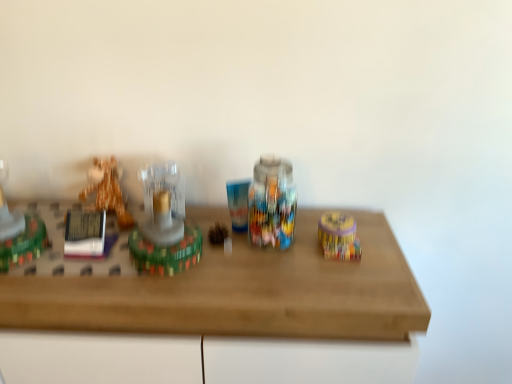
What is the approximate height of matte yellow container at right, which ranks as the 4th toy in left-to-right order?

matte yellow container at right, which ranks as the 4th toy in left-to-right order, is 0.93 inches in height.

Describe the element at coordinates (339, 236) in the screenshot. I see `matte yellow container at right, which is counted as the first toy, starting from the right` at that location.

This screenshot has height=384, width=512. I want to click on translucent glass candle at center, placed as the third toy when sorted from left to right, so click(x=164, y=226).

You are a GUI agent. You are given a task and a screenshot of the screen. Output one action in this format:
    pyautogui.click(x=<x>, y=<y>)
    Task: Click on the plush orange bear at left, which is counted as the second toy, starting from the left
    The image size is (512, 384).
    Given the screenshot: What is the action you would take?
    pyautogui.click(x=106, y=190)

Considering the positions of point (36, 243) and point (242, 296), is point (36, 243) closer or farther from the camera than point (242, 296)?

Clearly, point (36, 243) is more distant from the camera than point (242, 296).

Does shiny green plastic toy at left, which appears as the 4th toy when viewed from the right, lie in front of wooden table at center?

No, the depth of shiny green plastic toy at left, which appears as the 4th toy when viewed from the right, is greater than that of wooden table at center.

Can wooden table at center be found inside shiny green plastic toy at left, acting as the 1th toy starting from the left?

No, wooden table at center is not a part of shiny green plastic toy at left, acting as the 1th toy starting from the left.

Looking at this image, does shiny green plastic toy at left, which appears as the 4th toy when viewed from the right, have a lesser height compared to wooden table at center?

Yes.

From the image's perspective, is wooden table at center on shiny green plastic toy at left, which appears as the 4th toy when viewed from the right?

No, from the image's perspective, wooden table at center is not on top of shiny green plastic toy at left, which appears as the 4th toy when viewed from the right.

Can shiny green plastic toy at left, acting as the 1th toy starting from the left, be found inside wooden table at center?

That's incorrect, shiny green plastic toy at left, acting as the 1th toy starting from the left, is not inside wooden table at center.

Is wooden table at center at the left side of shiny green plastic toy at left, which appears as the 4th toy when viewed from the right?

In fact, wooden table at center is to the right of shiny green plastic toy at left, which appears as the 4th toy when viewed from the right.

Which of these two, wooden table at center or shiny green plastic toy at left, acting as the 1th toy starting from the left, is thinner?

Thinner between the two is shiny green plastic toy at left, acting as the 1th toy starting from the left.

Based on the photo, considering the sizes of objects matte yellow container at right, which ranks as the 4th toy in left-to-right order, and shiny green plastic toy at left, which appears as the 4th toy when viewed from the right, in the image provided, who is thinner, matte yellow container at right, which ranks as the 4th toy in left-to-right order, or shiny green plastic toy at left, which appears as the 4th toy when viewed from the right,?

matte yellow container at right, which ranks as the 4th toy in left-to-right order, is thinner.

Is matte yellow container at right, which is counted as the first toy, starting from the right, positioned far away from shiny green plastic toy at left, acting as the 1th toy starting from the left?

No, matte yellow container at right, which is counted as the first toy, starting from the right, is in close proximity to shiny green plastic toy at left, acting as the 1th toy starting from the left.

Is shiny green plastic toy at left, acting as the 1th toy starting from the left, inside matte yellow container at right, which is counted as the first toy, starting from the right?

Definitely not — shiny green plastic toy at left, acting as the 1th toy starting from the left, is not inside matte yellow container at right, which is counted as the first toy, starting from the right.

From the image's perspective, is translucent glass candle at center, placed as the third toy when sorted from left to right, located beneath matte yellow container at right, which ranks as the 4th toy in left-to-right order?

No, from the image's perspective, translucent glass candle at center, placed as the third toy when sorted from left to right, is not below matte yellow container at right, which ranks as the 4th toy in left-to-right order.

Can you confirm if translucent glass candle at center, placed as the third toy when sorted from left to right, is taller than matte yellow container at right, which is counted as the first toy, starting from the right?

Indeed, translucent glass candle at center, placed as the third toy when sorted from left to right, has a greater height compared to matte yellow container at right, which is counted as the first toy, starting from the right.

Can you tell me how much translucent glass candle at center, positioned as the second toy in right-to-left order, and matte yellow container at right, which is counted as the first toy, starting from the right, differ in facing direction?

The angle between the facing direction of translucent glass candle at center, positioned as the second toy in right-to-left order, and the facing direction of matte yellow container at right, which is counted as the first toy, starting from the right, is 1.97 degrees.

Does translucent glass candle at center, positioned as the second toy in right-to-left order, have a smaller size compared to matte yellow container at right, which is counted as the first toy, starting from the right?

No, translucent glass candle at center, positioned as the second toy in right-to-left order, is not smaller than matte yellow container at right, which is counted as the first toy, starting from the right.

Considering the relative sizes of plush orange bear at left, the 3th toy viewed from the right, and matte yellow container at right, which is counted as the first toy, starting from the right, in the image provided, is plush orange bear at left, the 3th toy viewed from the right, shorter than matte yellow container at right, which is counted as the first toy, starting from the right,?

Incorrect, the height of plush orange bear at left, the 3th toy viewed from the right, does not fall short of that of matte yellow container at right, which is counted as the first toy, starting from the right.

Are plush orange bear at left, which is counted as the second toy, starting from the left, and matte yellow container at right, which is counted as the first toy, starting from the right, making contact?

No, plush orange bear at left, which is counted as the second toy, starting from the left, is not touching matte yellow container at right, which is counted as the first toy, starting from the right.

Is plush orange bear at left, the 3th toy viewed from the right, facing towards matte yellow container at right, which ranks as the 4th toy in left-to-right order?

No, plush orange bear at left, the 3th toy viewed from the right, does not turn towards matte yellow container at right, which ranks as the 4th toy in left-to-right order.

Is plush orange bear at left, which is counted as the second toy, starting from the left, inside or outside of matte yellow container at right, which is counted as the first toy, starting from the right?

plush orange bear at left, which is counted as the second toy, starting from the left, is spatially situated outside matte yellow container at right, which is counted as the first toy, starting from the right.

Is plush orange bear at left, the 3th toy viewed from the right, in contact with shiny green plastic toy at left, which appears as the 4th toy when viewed from the right?

plush orange bear at left, the 3th toy viewed from the right, and shiny green plastic toy at left, which appears as the 4th toy when viewed from the right, are clearly separated.

Which toy is the 2nd one when counting from the front of the plush orange bear at left, the 3th toy viewed from the right? Please provide its 2D coordinates.

[(19, 232)]

Can you tell me how much plush orange bear at left, the 3th toy viewed from the right, and shiny green plastic toy at left, which appears as the 4th toy when viewed from the right, differ in facing direction?

They differ by 0.000105 degrees in their facing directions.

Is plush orange bear at left, which is counted as the second toy, starting from the left, inside the boundaries of shiny green plastic toy at left, which appears as the 4th toy when viewed from the right, or outside?

plush orange bear at left, which is counted as the second toy, starting from the left, is not enclosed by shiny green plastic toy at left, which appears as the 4th toy when viewed from the right.

From the image's perspective, would you say shiny green plastic toy at left, which appears as the 4th toy when viewed from the right, is shown under translucent glass candle at center, placed as the third toy when sorted from left to right?

No, from the image's perspective, shiny green plastic toy at left, which appears as the 4th toy when viewed from the right, is not beneath translucent glass candle at center, placed as the third toy when sorted from left to right.

Considering the relative sizes of shiny green plastic toy at left, which appears as the 4th toy when viewed from the right, and translucent glass candle at center, positioned as the second toy in right-to-left order, in the image provided, is shiny green plastic toy at left, which appears as the 4th toy when viewed from the right, taller than translucent glass candle at center, positioned as the second toy in right-to-left order,?

Incorrect, the height of shiny green plastic toy at left, which appears as the 4th toy when viewed from the right, is not larger of that of translucent glass candle at center, positioned as the second toy in right-to-left order.

Considering the sizes of objects shiny green plastic toy at left, which appears as the 4th toy when viewed from the right, and translucent glass candle at center, placed as the third toy when sorted from left to right, in the image provided, who is wider, shiny green plastic toy at left, which appears as the 4th toy when viewed from the right, or translucent glass candle at center, placed as the third toy when sorted from left to right,?

With larger width is shiny green plastic toy at left, which appears as the 4th toy when viewed from the right.

Identify the location of toy that is the 3rd one when counting upward from the wooden table at center (from the image's perspective). (19, 232).

You are a GUI agent. You are given a task and a screenshot of the screen. Output one action in this format:
    pyautogui.click(x=<x>, y=<y>)
    Task: Click on the table on the right of shiny green plastic toy at left, which appears as the 4th toy when viewed from the right
    Image resolution: width=512 pixels, height=384 pixels.
    Given the screenshot: What is the action you would take?
    pyautogui.click(x=223, y=287)

Considering their positions, is wooden table at center positioned further to matte yellow container at right, which ranks as the 4th toy in left-to-right order, than shiny green plastic toy at left, which appears as the 4th toy when viewed from the right?

Based on the image, shiny green plastic toy at left, which appears as the 4th toy when viewed from the right, appears to be further to matte yellow container at right, which ranks as the 4th toy in left-to-right order.

From the image, which object appears to be farther from shiny green plastic toy at left, acting as the 1th toy starting from the left, translucent glass candle at center, placed as the third toy when sorted from left to right, or matte yellow container at right, which is counted as the first toy, starting from the right?

matte yellow container at right, which is counted as the first toy, starting from the right, lies further to shiny green plastic toy at left, acting as the 1th toy starting from the left, than the other object.

From the image, which object appears to be farther from translucent glass candle at center, positioned as the second toy in right-to-left order, wooden table at center or shiny green plastic toy at left, which appears as the 4th toy when viewed from the right?

shiny green plastic toy at left, which appears as the 4th toy when viewed from the right, is further to translucent glass candle at center, positioned as the second toy in right-to-left order.

Which object lies further to the anchor point translucent glass candle at center, positioned as the second toy in right-to-left order, wooden table at center or plush orange bear at left, the 3th toy viewed from the right?

plush orange bear at left, the 3th toy viewed from the right, is positioned further to the anchor translucent glass candle at center, positioned as the second toy in right-to-left order.

Looking at the image, which one is located closer to shiny green plastic toy at left, which appears as the 4th toy when viewed from the right, matte yellow container at right, which ranks as the 4th toy in left-to-right order, or wooden table at center?

Based on the image, wooden table at center appears to be nearer to shiny green plastic toy at left, which appears as the 4th toy when viewed from the right.

Considering their positions, is wooden table at center positioned further to matte yellow container at right, which ranks as the 4th toy in left-to-right order, than translucent glass candle at center, placed as the third toy when sorted from left to right?

Based on the image, translucent glass candle at center, placed as the third toy when sorted from left to right, appears to be further to matte yellow container at right, which ranks as the 4th toy in left-to-right order.

Looking at the image, which one is located closer to matte yellow container at right, which is counted as the first toy, starting from the right, translucent glass candle at center, placed as the third toy when sorted from left to right, or shiny green plastic toy at left, acting as the 1th toy starting from the left?

translucent glass candle at center, placed as the third toy when sorted from left to right, is positioned closer to the anchor matte yellow container at right, which is counted as the first toy, starting from the right.

From the image, which object appears to be farther from matte yellow container at right, which ranks as the 4th toy in left-to-right order, shiny green plastic toy at left, which appears as the 4th toy when viewed from the right, or translucent glass candle at center, positioned as the second toy in right-to-left order?

shiny green plastic toy at left, which appears as the 4th toy when viewed from the right, is positioned further to the anchor matte yellow container at right, which ranks as the 4th toy in left-to-right order.

This screenshot has height=384, width=512. Identify the location of toy located between shiny green plastic toy at left, which appears as the 4th toy when viewed from the right, and translucent glass candle at center, placed as the third toy when sorted from left to right, in the left-right direction. (x=106, y=190).

At what (x,y) coordinates should I click in order to perform the action: click on table between plush orange bear at left, which is counted as the second toy, starting from the left, and matte yellow container at right, which ranks as the 4th toy in left-to-right order, from left to right. Please return your answer as a coordinate pair (x, y). This screenshot has width=512, height=384. Looking at the image, I should click on (223, 287).

At what (x,y) coordinates should I click in order to perform the action: click on table located between shiny green plastic toy at left, which appears as the 4th toy when viewed from the right, and matte yellow container at right, which ranks as the 4th toy in left-to-right order, in the left-right direction. Please return your answer as a coordinate pair (x, y). Image resolution: width=512 pixels, height=384 pixels. Looking at the image, I should click on (223, 287).

Where is `toy between wooden table at center and matte yellow container at right, which ranks as the 4th toy in left-to-right order, in the horizontal direction`? The image size is (512, 384). toy between wooden table at center and matte yellow container at right, which ranks as the 4th toy in left-to-right order, in the horizontal direction is located at coordinates (164, 226).